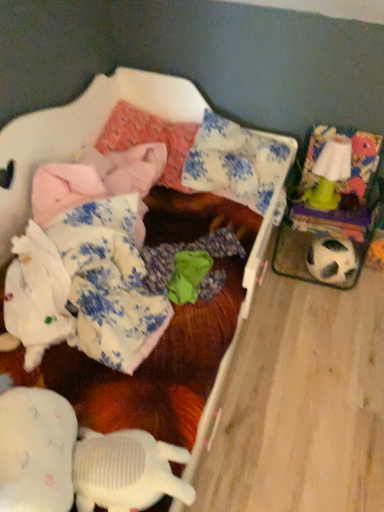
At what (x,y) coordinates should I click in order to perform the action: click on free space in front of green plastic lamp at upper right. Please return your answer as a coordinate pair (x, y). This screenshot has height=512, width=384. Looking at the image, I should click on (338, 214).